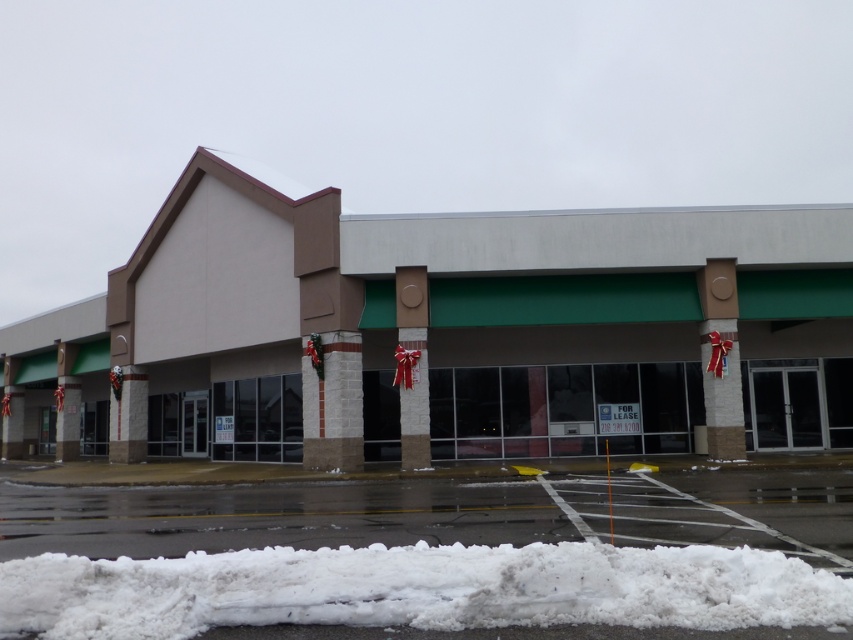
You are planning to park your car in the white asphalt parking lot at lower center. However, there is white fluffy snow at lower center in the area. Can you park your car there without the snow affecting the parking space?

The white fluffy snow at lower center has a smaller size compared to the white asphalt parking lot at lower center, so there is enough space to park your car without the snow affecting the parking space.

You are standing in front of the commercial building and notice the white concrete building at center and the white fluffy snow at lower center. Which object is positioned higher in the image?

The white fluffy snow at lower center is higher than the white concrete building at center.